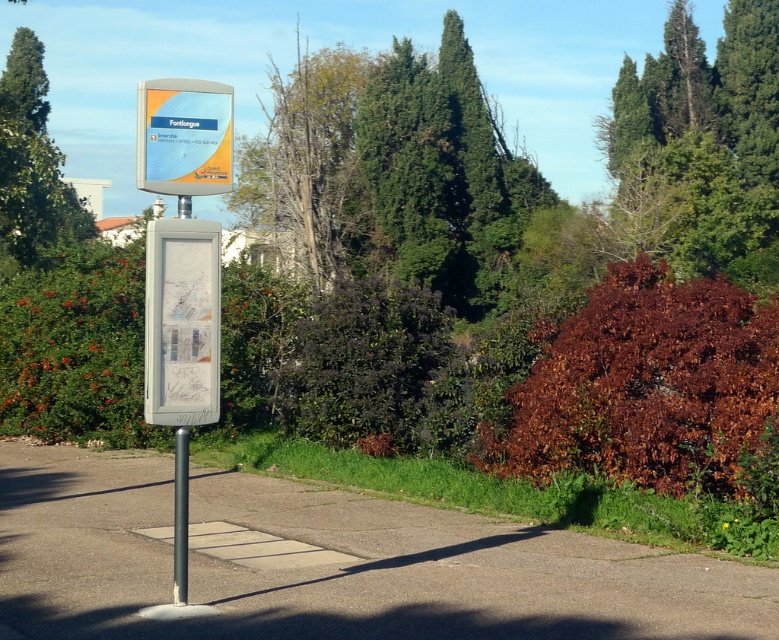
Can you confirm if green leafy tree at upper right is bigger than white plastic map at center?

Indeed, green leafy tree at upper right has a larger size compared to white plastic map at center.

Find the location of `green leafy tree at upper right`. green leafy tree at upper right is located at coordinates (700, 147).

Does white plastic map at center have a greater height compared to matte plastic sign at center?

No.

Describe the element at coordinates (182, 321) in the screenshot. I see `white plastic map at center` at that location.

You are a GUI agent. You are given a task and a screenshot of the screen. Output one action in this format:
    pyautogui.click(x=<x>, y=<y>)
    Task: Click on the white plastic map at center
    The width and height of the screenshot is (779, 640).
    Given the screenshot: What is the action you would take?
    pyautogui.click(x=182, y=321)

Does point (319, 209) lie in front of point (182, 516)?

No, (319, 209) is further to viewer.

Describe the element at coordinates (309, 170) in the screenshot. The height and width of the screenshot is (640, 779). I see `dead wood tree at center` at that location.

Which is in front, point (339, 131) or point (174, 499)?

Point (174, 499)

Locate an element on the screen. Image resolution: width=779 pixels, height=640 pixels. dead wood tree at center is located at coordinates (309, 170).